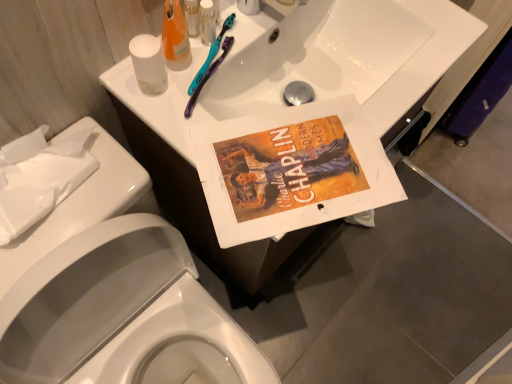
Identify the location of free location to the right of clear plastic bottle at upper center, placed as the 1th toiletry when sorted from right to left. (256, 41).